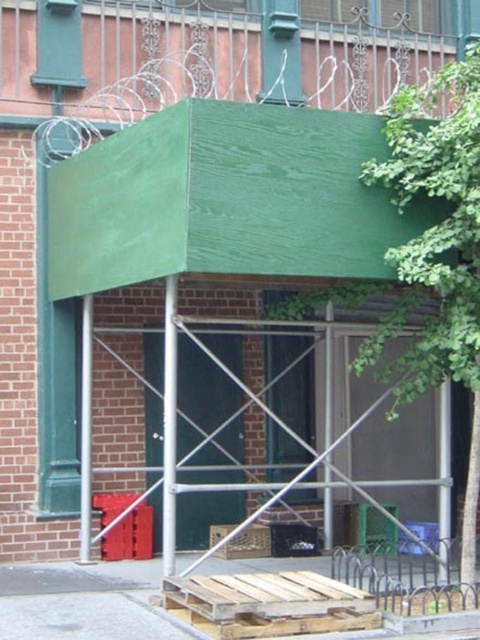
You are a delivery person trying to unload a large package that requires a space bigger than the brown cardboard crate at center. Is there enough space near the green leafy tree at upper center to place it?

The green leafy tree at upper center is larger in size than the brown cardboard crate at center, so there might be sufficient space near the green leafy tree at upper center to place the large package.

You are standing in front of the building with the green awning and scaffolding. You notice two points marked in the scene. Which point is closer to you, point [427,355] or point [245,541]?

Point [427,355] is closer to the viewer than point [245,541].